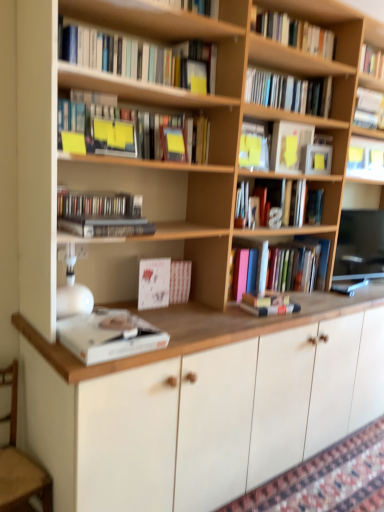
Question: In terms of width, does matte black compact disc case at left, the fifth book when ordered from bottom to top, look wider or thinner when compared to hardcover book at center, which is counted as the 2th book, starting from the bottom?

Choices:
 (A) thin
 (B) wide

Answer: (A)

Question: From a real-world perspective, relative to hardcover book at center, which is the eleventh book from top to bottom, is matte black compact disc case at left, acting as the 8th book starting from the top, vertically above or below?

Choices:
 (A) below
 (B) above

Answer: (B)

Question: Which of these objects is positioned farthest from the white matte book at lower left, which is the twelfth book in top-to-bottom order?

Choices:
 (A) matte black compact disc case at left, the fifth book when ordered from bottom to top
 (B) hardcover book at center, which is counted as the 2th book, starting from the bottom
 (C) hardcover book at center, which ranks as the 6th book in bottom-to-top order
 (D) hardcover books at upper center, marked as the 9th book in a bottom-to-top arrangement
 (E) hardcover book at center, arranged as the 4th book when ordered from the bottom

Answer: (C)

Question: Which object is positioned farthest from the hardcover books at upper right, which ranks as the eleventh book in bottom-to-top order?

Choices:
 (A) white matte book at lower left, positioned as the 1th book in bottom-to-top order
 (B) hardcover books at upper center, positioned as the 4th book in top-to-bottom order
 (C) hardcover book at upper right, which is counted as the 8th book, starting from the bottom
 (D) hardcover book at upper right, the 1th book in the top-to-bottom sequence
 (E) matte white paperback book at upper right

Answer: (A)